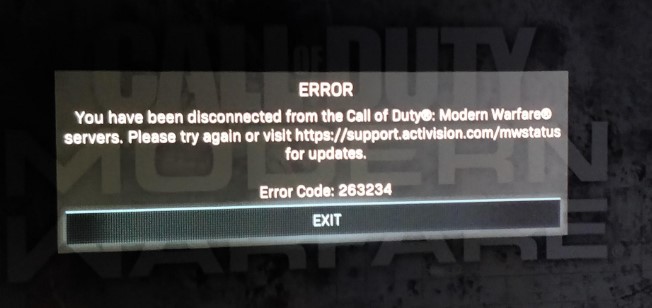
Where is `exit button`? The width and height of the screenshot is (652, 308). exit button is located at coordinates (356, 226).